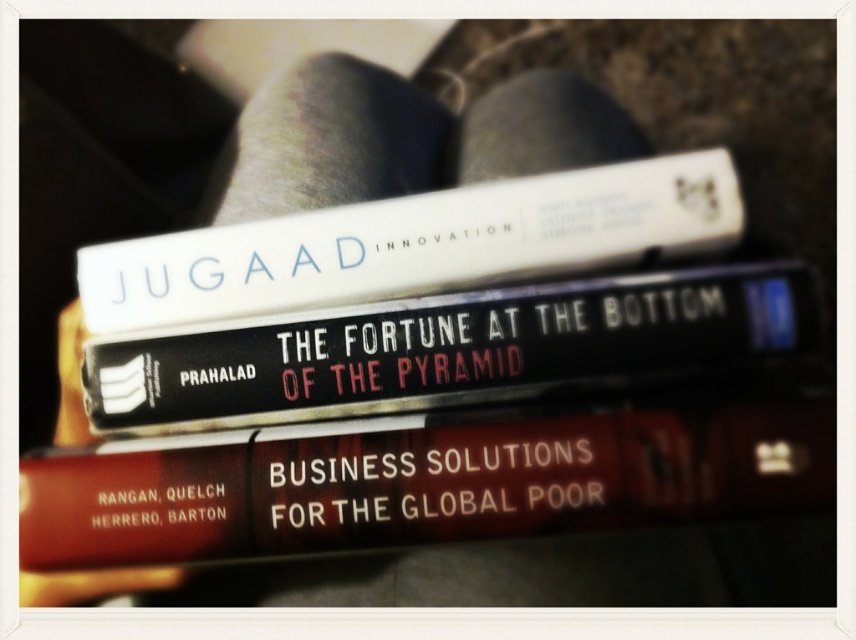
Question: Which is farther from the black matte book at center?

Choices:
 (A) white matte book at upper center
 (B) red matte book at center

Answer: (B)

Question: Is black matte book at center closer to camera compared to white matte book at upper center?

Choices:
 (A) yes
 (B) no

Answer: (A)

Question: Which of the following is the farthest from the observer?

Choices:
 (A) (471, 445)
 (B) (530, 372)

Answer: (B)

Question: Which object is closer to the camera taking this photo?

Choices:
 (A) red matte book at center
 (B) white matte book at upper center

Answer: (A)

Question: Is red matte book at center further to the viewer compared to black matte book at center?

Choices:
 (A) no
 (B) yes

Answer: (A)

Question: Can you confirm if black matte book at center is positioned below white matte book at upper center?

Choices:
 (A) yes
 (B) no

Answer: (A)